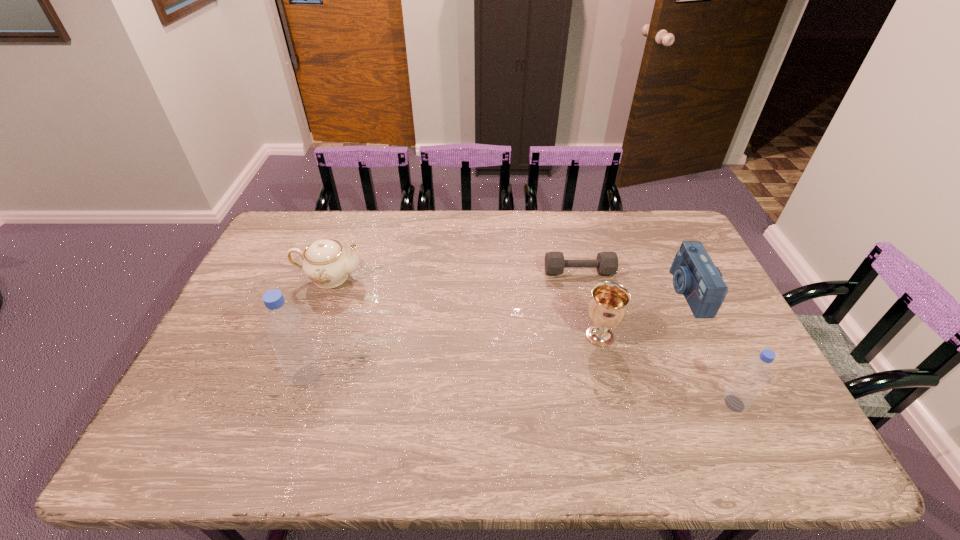
If the aim is uniform spacing by inserting an additional bottle among them, please point to a vacant space for this new bottle. Please provide its 2D coordinates. Your answer should be formatted as a tuple, i.e. [(x, y)], where the tuple contains the x and y coordinates of a point satisfying the conditions above.

[(516, 389)]